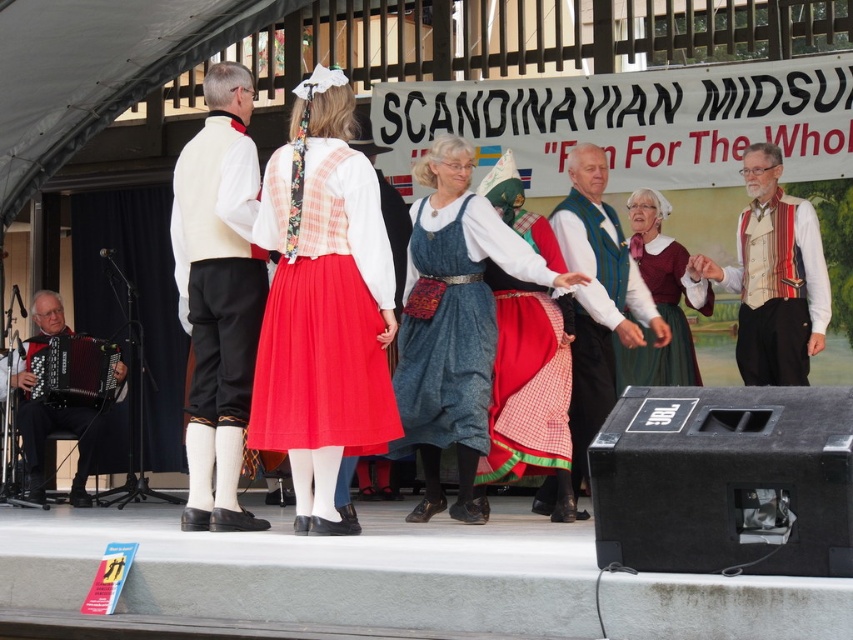
Question: Is white cotton vest at center closer to the viewer compared to black leather accordion at left?

Choices:
 (A) no
 (B) yes

Answer: (B)

Question: Which object is positioned farthest from the matte red skirt at center?

Choices:
 (A) striped wool vest at center
 (B) black leather accordion at left
 (C) white cotton vest at center
 (D) denim dress at center

Answer: (B)

Question: Estimate the real-world distances between objects in this image. Which object is farther from the denim dress at center?

Choices:
 (A) matte white blouse at center
 (B) green knitted vest at center
 (C) black leather accordion at left
 (D) striped wool vest at center

Answer: (C)

Question: Which point appears closest to the camera in this image?

Choices:
 (A) (581, 362)
 (B) (222, 81)
 (C) (531, 275)
 (D) (695, 364)

Answer: (B)

Question: Can you confirm if white cotton vest at center is positioned to the left of black leather accordion at left?

Choices:
 (A) no
 (B) yes

Answer: (A)

Question: Does denim dress at center have a smaller size compared to striped wool vest at center?

Choices:
 (A) no
 (B) yes

Answer: (A)